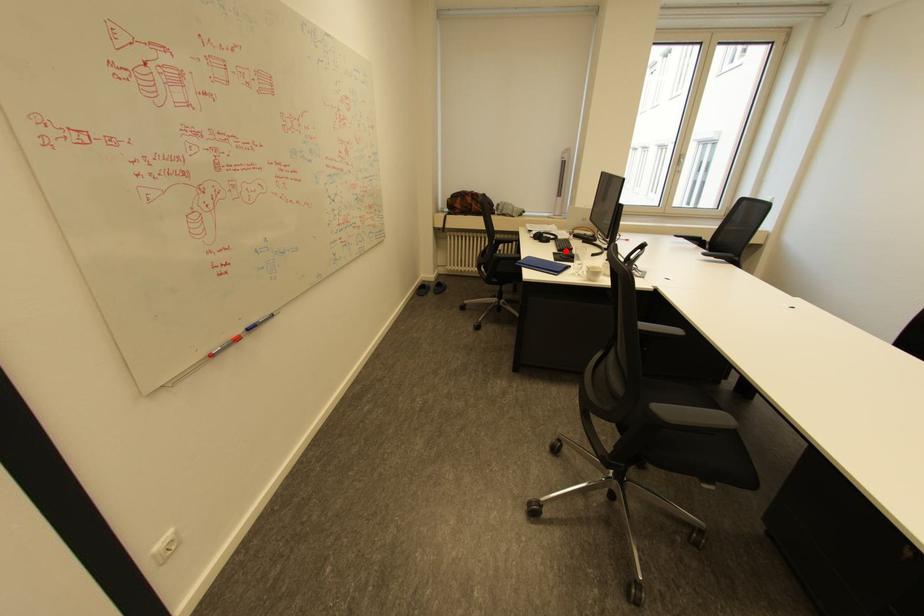
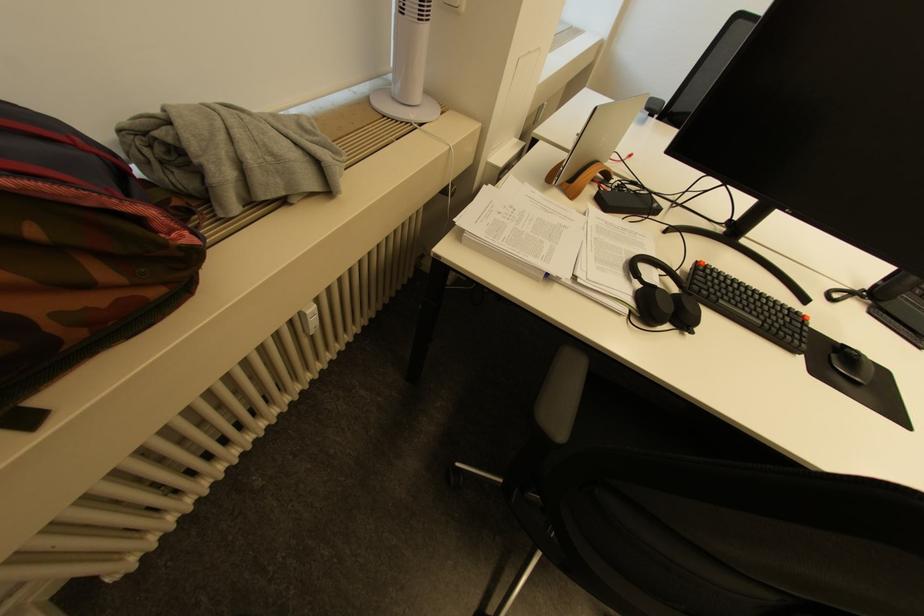
Where in the second image is the point corresponding to the highlighted location from the first image?

(800, 351)